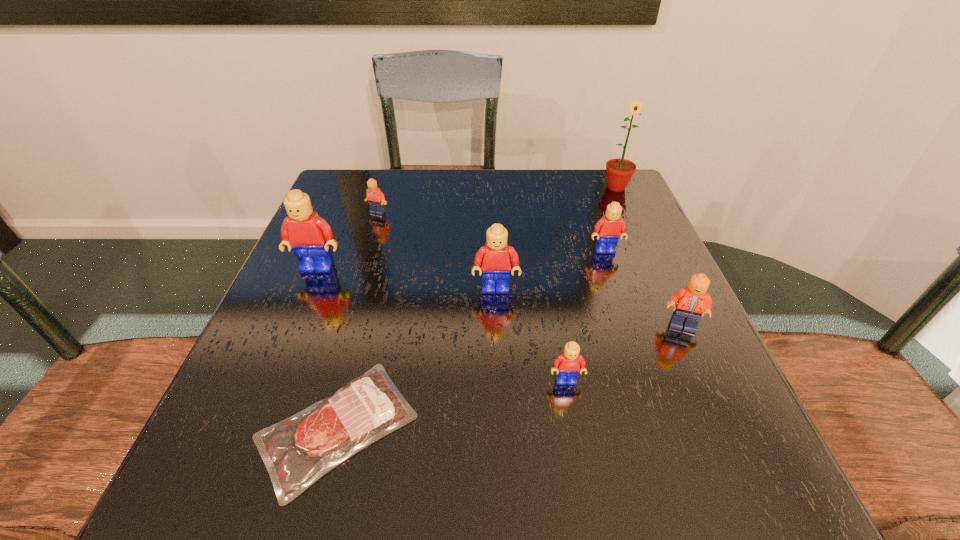
At what (x,y) coordinates should I click in order to perform the action: click on the tallest object. Please return your answer as a coordinate pair (x, y). The image size is (960, 540). Looking at the image, I should click on (619, 170).

What are the coordinates of `sunflower` in the screenshot? It's located at (619, 170).

Identify the location of the leftmost yellow Lego. (309, 235).

Locate an element on the screen. the leftmost Lego is located at coordinates (309, 235).

This screenshot has height=540, width=960. Find the location of `the second biggest yellow Lego`. the second biggest yellow Lego is located at coordinates (492, 260).

The width and height of the screenshot is (960, 540). What are the coordinates of `the fourth Lego from right to left` in the screenshot? It's located at (492, 260).

The width and height of the screenshot is (960, 540). Identify the location of the rightmost Lego. (692, 301).

Where is `the nearer orange Lego`? the nearer orange Lego is located at coordinates (692, 301).

The height and width of the screenshot is (540, 960). Find the location of `the third object from right to left`. the third object from right to left is located at coordinates (610, 227).

Locate an element on the screen. the rightmost yellow Lego is located at coordinates coord(610,227).